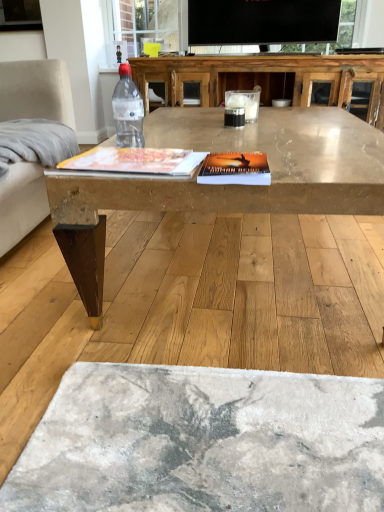
This screenshot has width=384, height=512. What are the coordinates of `vacant space underneath matte wooden coffee table at center (from a real-world perspective)` in the screenshot? It's located at (247, 261).